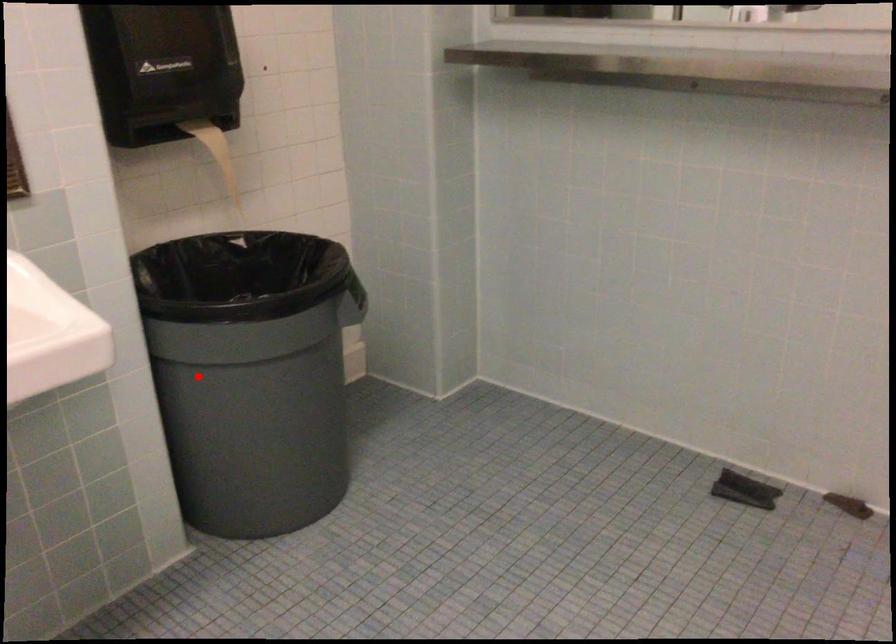
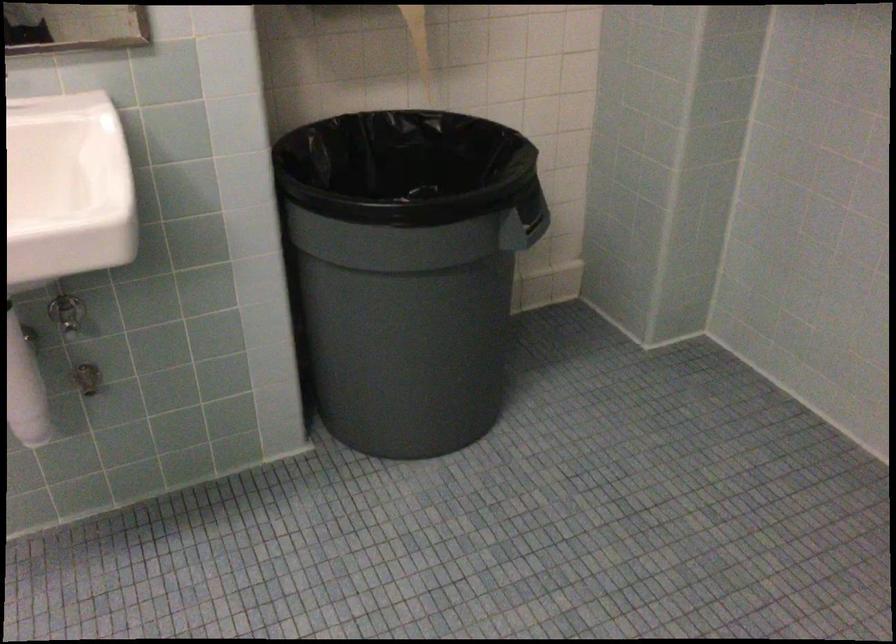
Question: I am providing you with two images of the same scene from different viewpoints. In image1, a red point is highlighted. Considering the same 3D point in image2, which of the following is correct?

Choices:
 (A) It is closer
 (B) It is farther

Answer: (A)